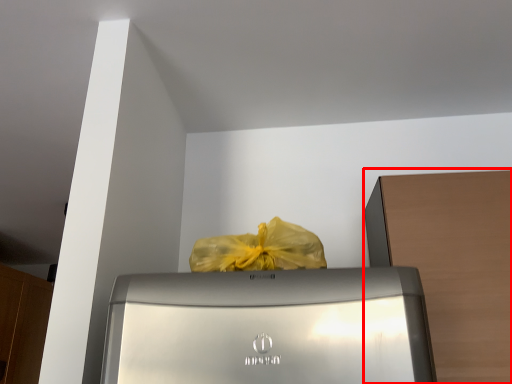
Question: From the image's perspective, what is the correct spatial relationship of cabinetry (annotated by the red box) in relation to cabinetry?

Choices:
 (A) below
 (B) above

Answer: (B)